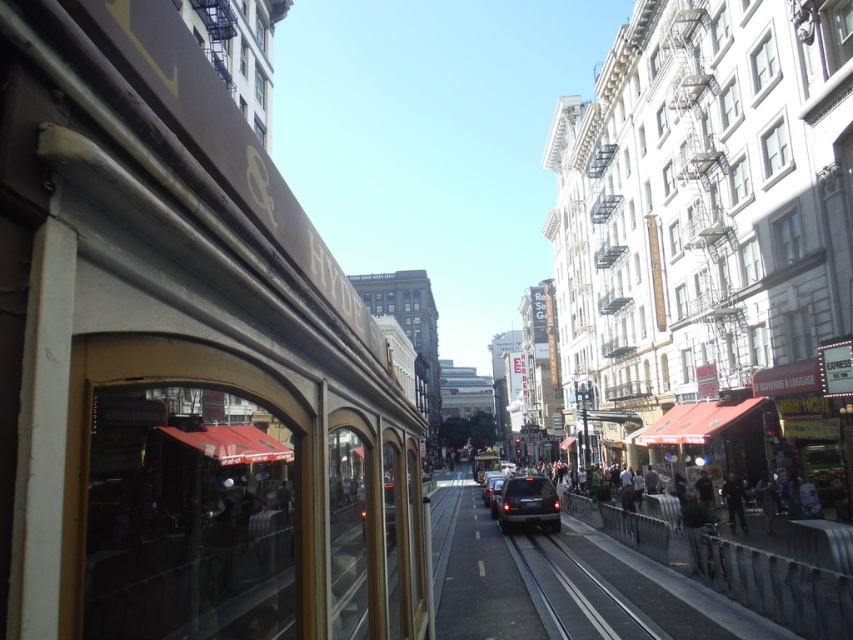
You are standing at the front of the tram and want to know the exact position of the metallic gray train track at center. What are its coordinates?

The metallic gray train track at center is located at point (x=575, y=593).

Looking at this image, you are a passenger in the tram and want to describe the scene outside the window. Which object, the dark gray jacket at lower right or the shiny black car at center, appears larger in the view?

The shiny black car at center appears larger than the dark gray jacket at lower right in the view.

In the scene shown: You are a delivery person trying to unload a package from your 1.2 meter tall delivery box. You see the metallic gray train track at center and the shiny black suv at center. Which object is taller than the delivery box?

The metallic gray train track at center is taller than the shiny black suv at center, so the metallic gray train track at center is taller than the delivery box.